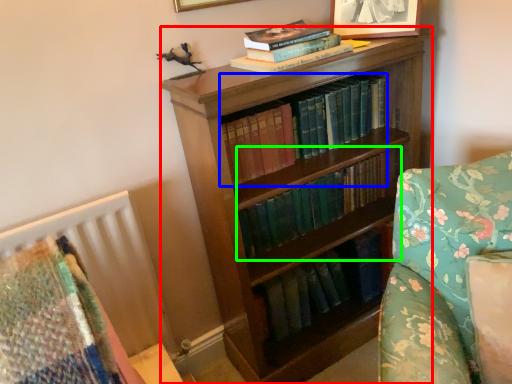
Question: Which object is positioned farthest from bookcase (highlighted by a red box)? Select from book (highlighted by a blue box) and book (highlighted by a green box).

Choices:
 (A) book
 (B) book

Answer: (A)